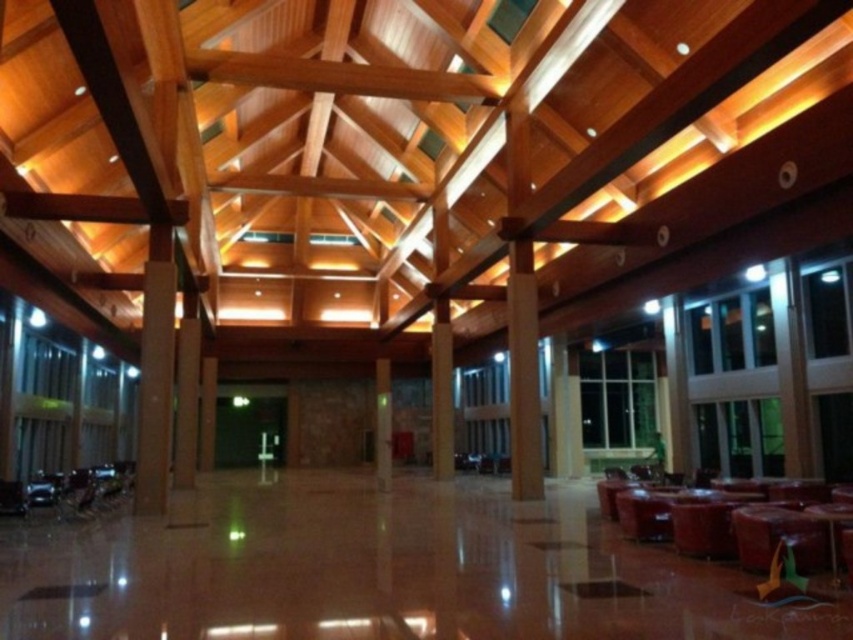
Question: Can you confirm if brown polished wood pillar at center is thinner than smooth stone pillar at center?

Choices:
 (A) yes
 (B) no

Answer: (A)

Question: Which object is closer to the camera taking this photo?

Choices:
 (A) brown polished pillar at center
 (B) brown polished wood pillar at center
 (C) satin gold column at center
 (D) wooden beam at center

Answer: (C)

Question: Which object is closer to the camera taking this photo?

Choices:
 (A) smooth stone pillar at center
 (B) wooden beam at center
 (C) brown polished wood pillar at center
 (D) brown polished pillar at center

Answer: (B)

Question: Which is nearer to the brown polished wood pillar at center?

Choices:
 (A) satin gold column at center
 (B) brown polished pillar at center

Answer: (A)

Question: Where is brown polished wood pillar at center located in relation to smooth stone pillar at center in the image?

Choices:
 (A) below
 (B) above

Answer: (B)

Question: Does satin gold column at center have a greater width compared to brown polished wood pillar at center?

Choices:
 (A) yes
 (B) no

Answer: (A)